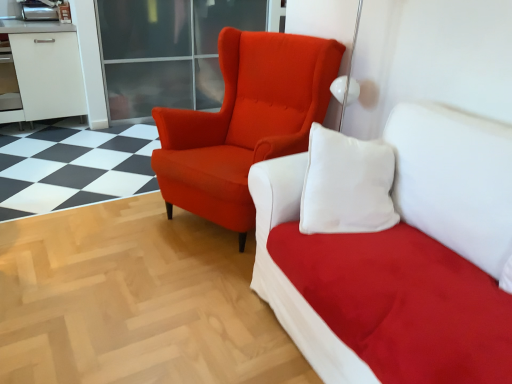
Question: Based on their sizes in the image, would you say suede white studio couch at upper center is bigger or smaller than matte orange armchair at center?

Choices:
 (A) small
 (B) big

Answer: (B)

Question: Does point (461, 120) appear closer or farther from the camera than point (230, 114)?

Choices:
 (A) farther
 (B) closer

Answer: (B)

Question: Estimate the real-world distances between objects in this image. Which object is closer to the suede white studio couch at upper center?

Choices:
 (A) matte orange armchair at center
 (B) transparent glass door at upper center

Answer: (A)

Question: Considering the real-world distances, which object is farthest from the transparent glass door at upper center?

Choices:
 (A) suede white studio couch at upper center
 (B) matte orange armchair at center

Answer: (A)